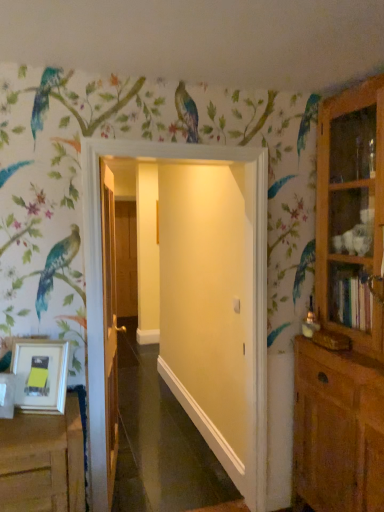
At what (x,y) coordinates should I click in order to perform the action: click on free space below wooden door at center, which is the 2th door in right-to-left order (from a real-world perspective). Please return your answer as a coordinate pair (x, y). Looking at the image, I should click on (123, 475).